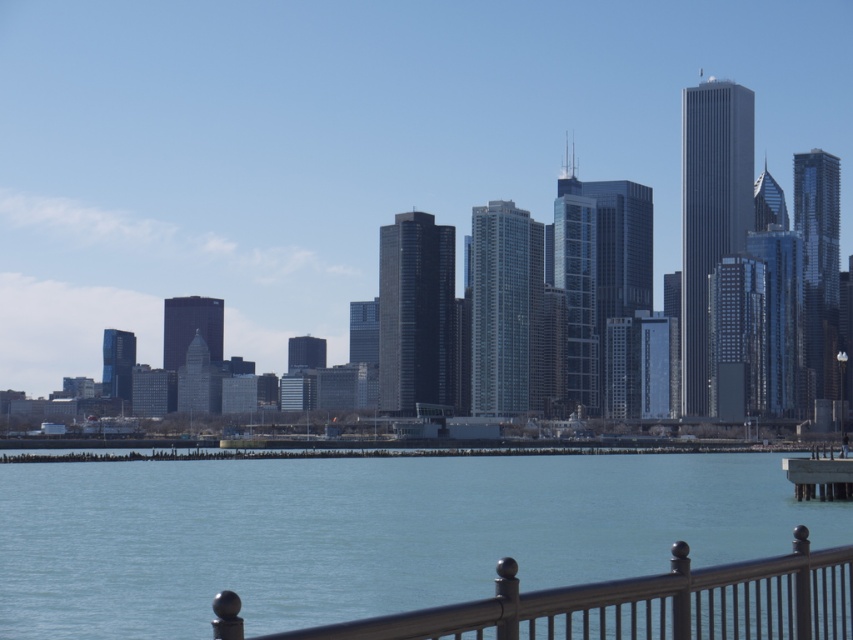
You are a photographer standing on the waterfront promenade. You want to capture a photo of the clear blue water at lower center in the foreground while including the metallic gray railing at lower center in the background. Can you achieve this composition without moving your position?

The distance between the clear blue water at lower center and the metallic gray railing at lower center is 290.92 meters. Since the railing is much farther away, you can position yourself so that the clear blue water at lower center is in the immediate foreground and the metallic gray railing at lower center appears in the background of the same frame.

You are standing on the gray concrete dock at lower right and want to reach the metallic gray railing at lower center. Which direction should you move to get there?

You should move upward because the metallic gray railing at lower center is above the gray concrete dock at lower right.

You are a photographer planning to capture the city skyline from the waterfront. You notice the clear blue water at lower center and the metallic gray railing at lower center. Which object will occupy more space in your photo?

The clear blue water at lower center will occupy more space in your photo because it has a larger size compared to the metallic gray railing at lower center.